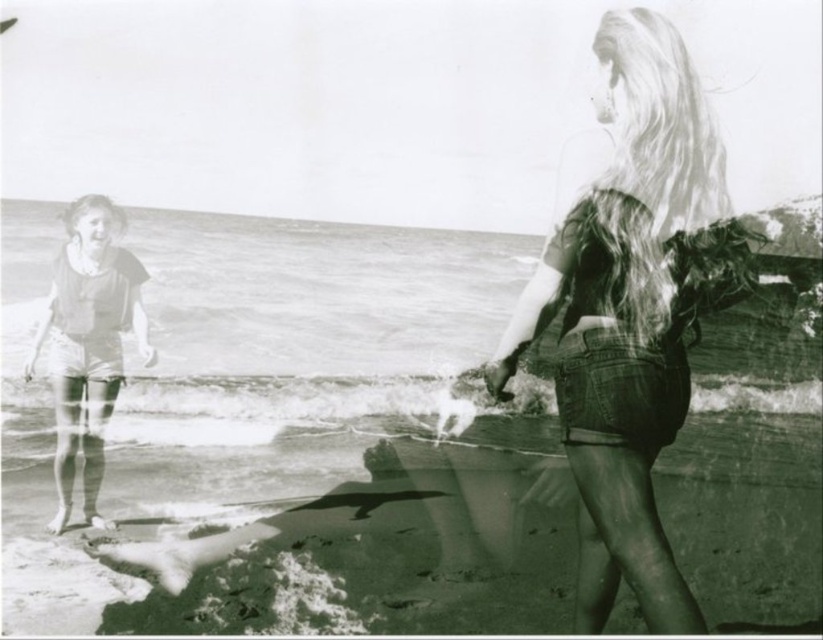
Question: Is denim shorts at center positioned behind matte fabric swimsuit at left?

Choices:
 (A) no
 (B) yes

Answer: (A)

Question: Is smooth sand at lower center bigger than denim shorts at center?

Choices:
 (A) yes
 (B) no

Answer: (B)

Question: Among these objects, which one is farthest from the camera?

Choices:
 (A) smooth sand at lower center
 (B) denim shorts at center
 (C) matte fabric swimsuit at left

Answer: (A)

Question: Which is nearer to the denim shorts at center?

Choices:
 (A) smooth sand at lower center
 (B) matte fabric swimsuit at left

Answer: (B)

Question: Estimate the real-world distances between objects in this image. Which object is farther from the denim shorts at center?

Choices:
 (A) smooth sand at lower center
 (B) matte fabric swimsuit at left

Answer: (A)

Question: Is denim shorts at center to the right of matte fabric swimsuit at left from the viewer's perspective?

Choices:
 (A) yes
 (B) no

Answer: (A)